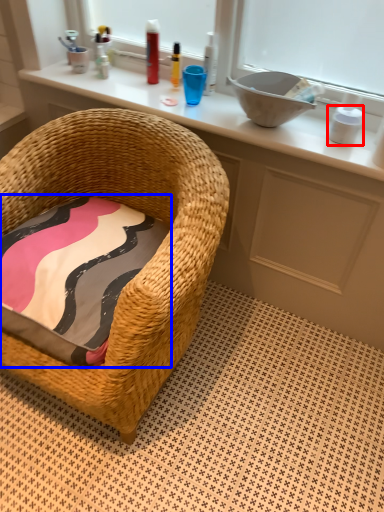
Question: Which object appears closest to the camera in this image, toiletry (highlighted by a red box) or pillow (highlighted by a blue box)?

Choices:
 (A) toiletry
 (B) pillow

Answer: (B)